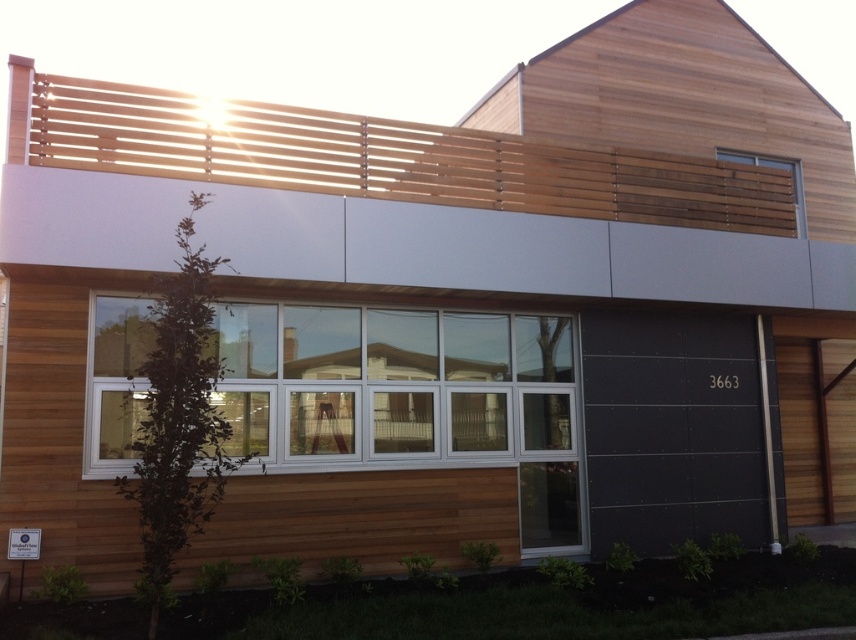
Question: From the image, what is the correct spatial relationship of clear glass window at center in relation to wooden slats at upper right?

Choices:
 (A) left
 (B) right

Answer: (A)

Question: Is clear glass window at center smaller than wooden slats at upper right?

Choices:
 (A) no
 (B) yes

Answer: (A)

Question: Which point is farther from the camera taking this photo?

Choices:
 (A) (803, 209)
 (B) (468, 346)

Answer: (A)

Question: Can you confirm if clear glass window at center is positioned to the left of wooden slats at upper right?

Choices:
 (A) yes
 (B) no

Answer: (A)